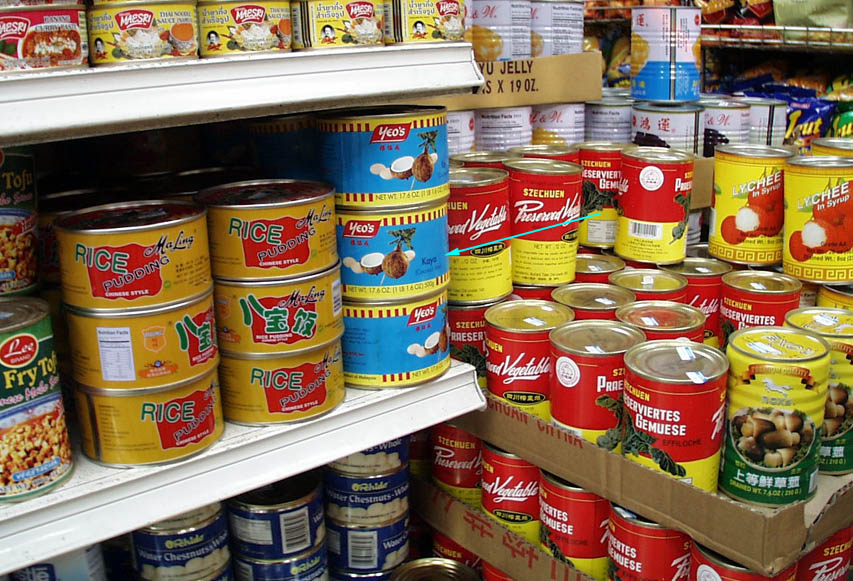
The image size is (853, 581). Identify the location of shelf. [316, 433], [280, 107].